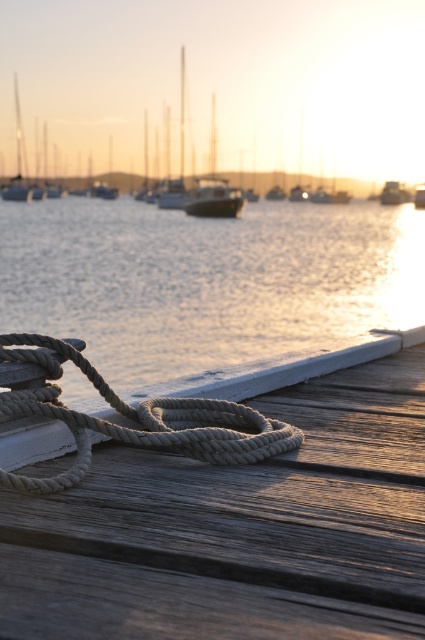
Question: Is shiny silver water at center above smooth black boat at center?

Choices:
 (A) yes
 (B) no

Answer: (B)

Question: Considering the relative positions of metallic silver boat at center and smooth black boat at center in the image provided, where is metallic silver boat at center located with respect to smooth black boat at center?

Choices:
 (A) left
 (B) right

Answer: (B)

Question: Which of the following is the closest to the observer?

Choices:
 (A) metallic silver boat at center
 (B) wooden dock at center
 (C) natural beige rope at lower left
 (D) metallic silver boat at right

Answer: (B)

Question: Based on their relative distances, which object is farther from the natural beige rope at lower left?

Choices:
 (A) metallic silver boat at right
 (B) smooth black boat at center
 (C) metallic silver boat at center
 (D) shiny silver water at center

Answer: (C)

Question: Can you confirm if metallic silver boat at center is positioned below metallic silver boat at right?

Choices:
 (A) no
 (B) yes

Answer: (A)

Question: Which is farther from the natural beige rope at lower left?

Choices:
 (A) wooden dock at center
 (B) smooth black boat at center

Answer: (B)